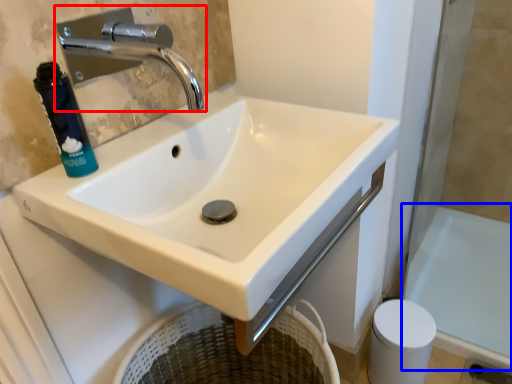
Question: Which object is closer to the camera taking this photo, tap (highlighted by a red box) or bath (highlighted by a blue box)?

Choices:
 (A) tap
 (B) bath

Answer: (A)